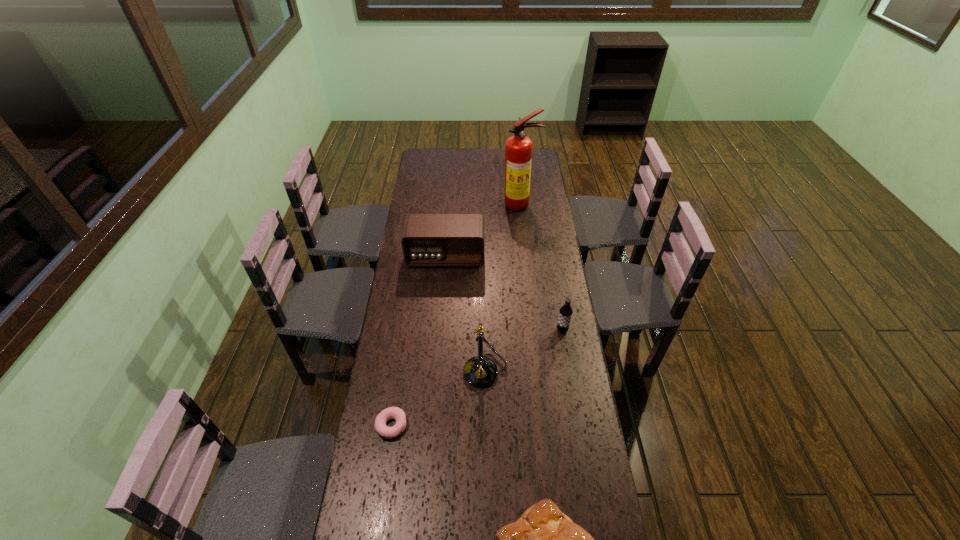
Where is `fire extinguisher`? This screenshot has height=540, width=960. fire extinguisher is located at coordinates (518, 149).

The width and height of the screenshot is (960, 540). What are the coordinates of `the tallest object` in the screenshot? It's located at (518, 149).

You are a GUI agent. You are given a task and a screenshot of the screen. Output one action in this format:
    pyautogui.click(x=<x>, y=<y>)
    Task: Click on the second farthest object
    
    Given the screenshot: What is the action you would take?
    pyautogui.click(x=429, y=240)

Find the location of `root beer`. root beer is located at coordinates (565, 314).

At what (x,y) coordinates should I click in order to perform the action: click on telephone. Please return your answer as a coordinate pair (x, y). Looking at the image, I should click on (480, 371).

Locate an element on the screen. the second nearest object is located at coordinates (396, 413).

Locate an element on the screen. Image resolution: width=960 pixels, height=540 pixels. doughnut is located at coordinates (396, 413).

Image resolution: width=960 pixels, height=540 pixels. Find the location of `free space located 0.390m on the front-facing side of the farthest object`. free space located 0.390m on the front-facing side of the farthest object is located at coordinates (527, 266).

You are a GUI agent. You are given a task and a screenshot of the screen. Output one action in this format:
    pyautogui.click(x=<x>, y=<y>)
    Task: Click on the free location located 0.380m on the front-facing side of the radio receiver
    The width and height of the screenshot is (960, 540).
    Given the screenshot: What is the action you would take?
    pyautogui.click(x=440, y=339)

You are a GUI agent. You are given a task and a screenshot of the screen. Output one action in this format:
    pyautogui.click(x=<x>, y=<y>)
    Task: Click on the vacant region located on the left of the root beer
    This screenshot has height=540, width=960.
    Given the screenshot: What is the action you would take?
    pyautogui.click(x=525, y=330)